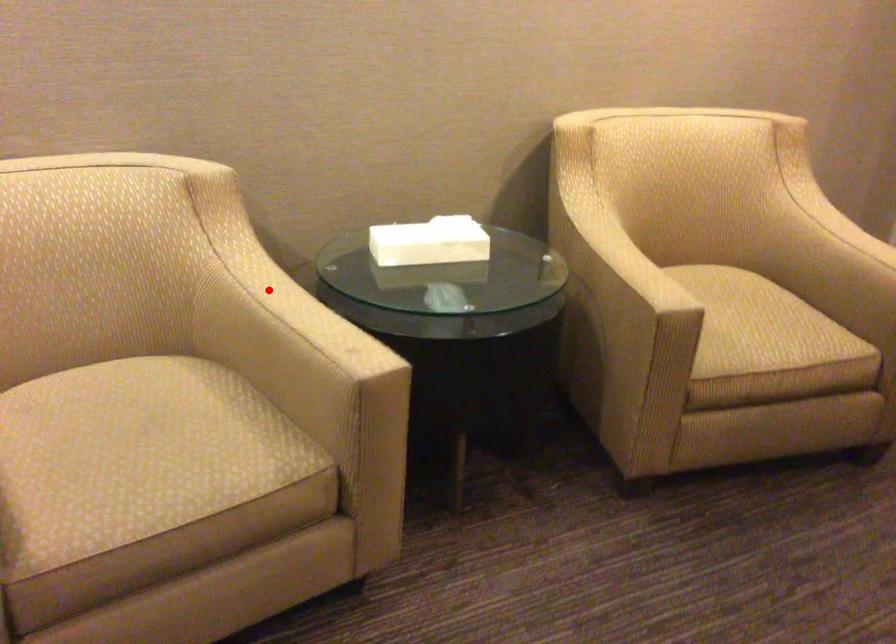
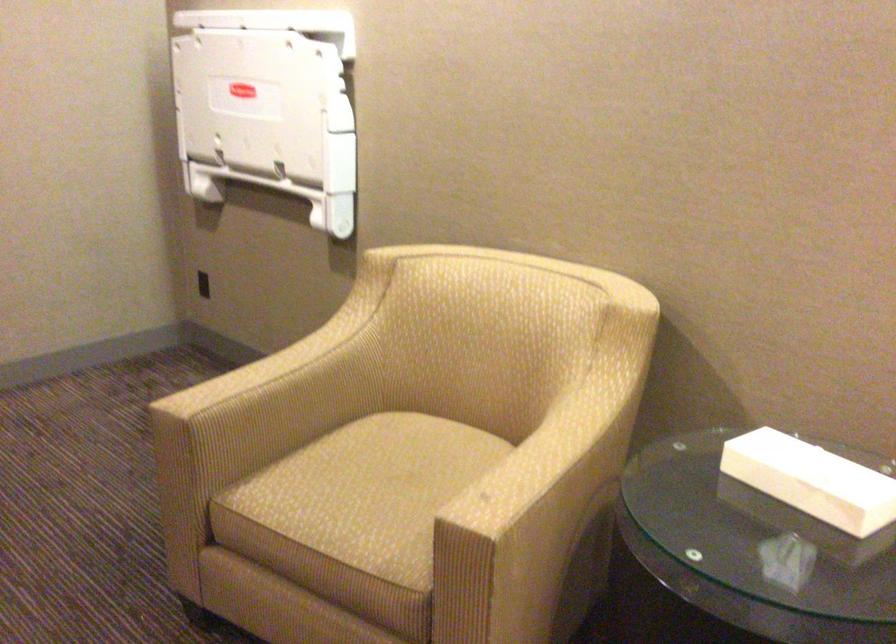
Find the pixel in the second image that matches the highlighted location in the first image.

(565, 426)